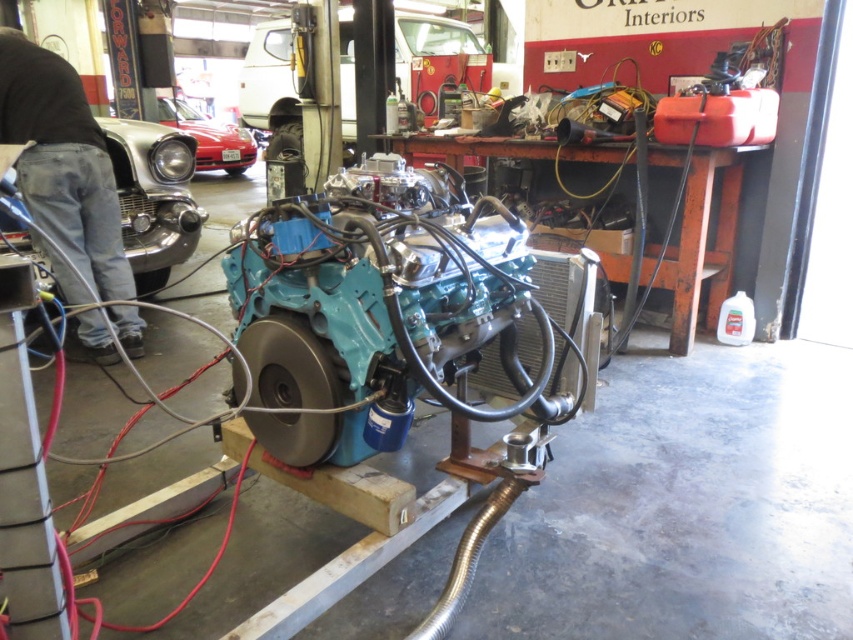
You are an automotive technician working in the garage. You need to move the shiny red car at center to access the engine on the stand. Can you drive it out without moving the metallic silver car at upper center first?

The metallic silver car at upper center is in front of the shiny red car at center. Therefore, you must move the metallic silver car at upper center first to access the shiny red car at center.